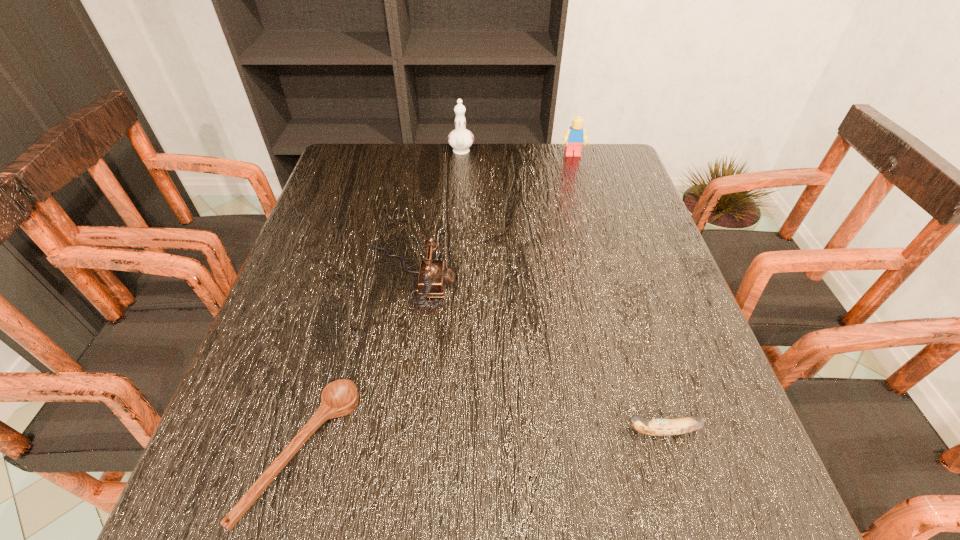
Where is `free region that satisfies the following two spatial constraints: 1. on the dial of the telephone; 2. on the front side of the shortest object`? The width and height of the screenshot is (960, 540). free region that satisfies the following two spatial constraints: 1. on the dial of the telephone; 2. on the front side of the shortest object is located at coordinates (379, 453).